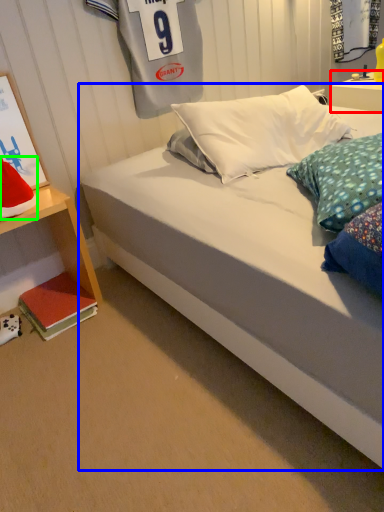
Question: Which object is the farthest from nightstand (highlighted by a red box)? Choose among these: bed (highlighted by a blue box) or pillow (highlighted by a green box).

Choices:
 (A) bed
 (B) pillow

Answer: (B)